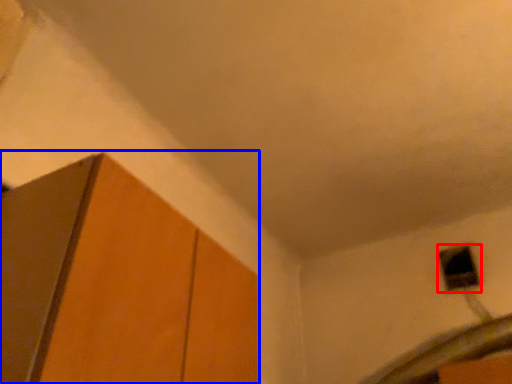
Question: Which of the following is the farthest to the observer, window (highlighted by a red box) or cabinetry (highlighted by a blue box)?

Choices:
 (A) window
 (B) cabinetry

Answer: (A)